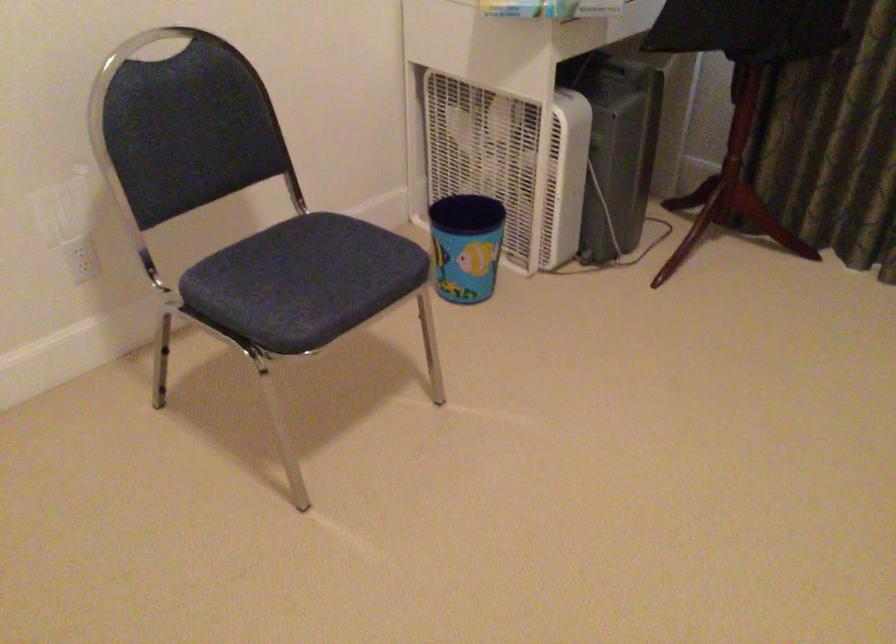
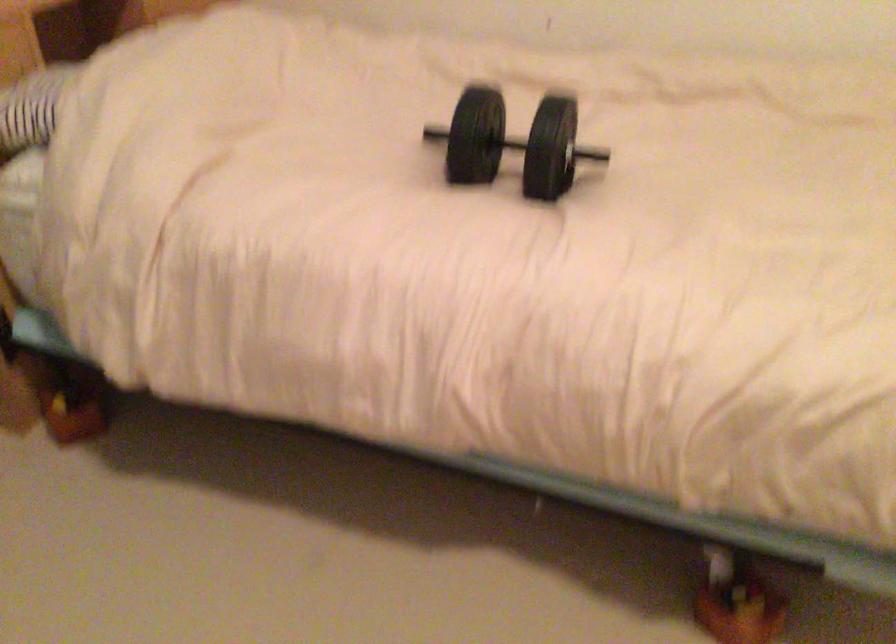
Based on the continuous images, in which direction is the camera rotating?

The camera rotated toward right-down.